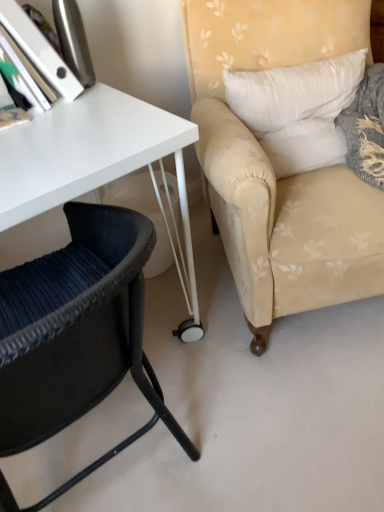
Identify the location of vacant space in black woven chair at lower left, arranged as the 2th chair when viewed from the right (from a real-world perspective). This screenshot has width=384, height=512. 117,464.